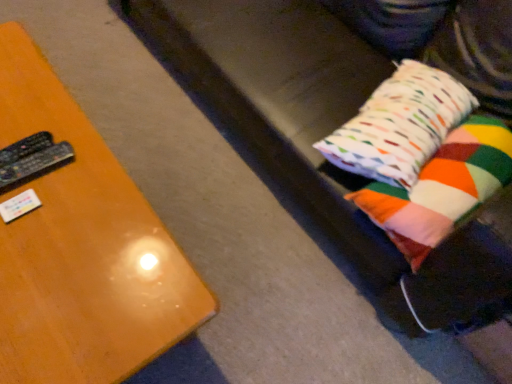
Locate an element on the screen. free space above wooden table at left (from a real-world perspective) is located at coordinates (54, 208).